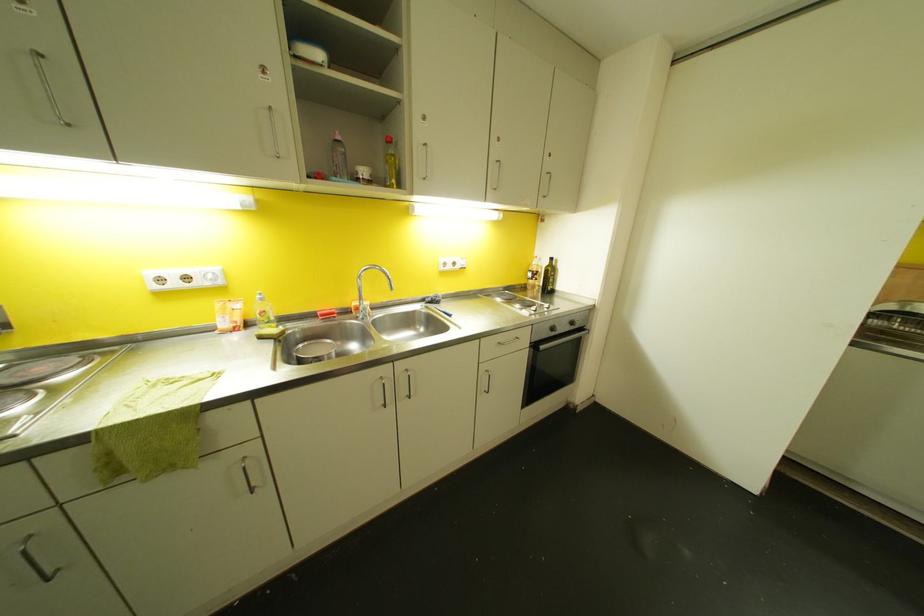
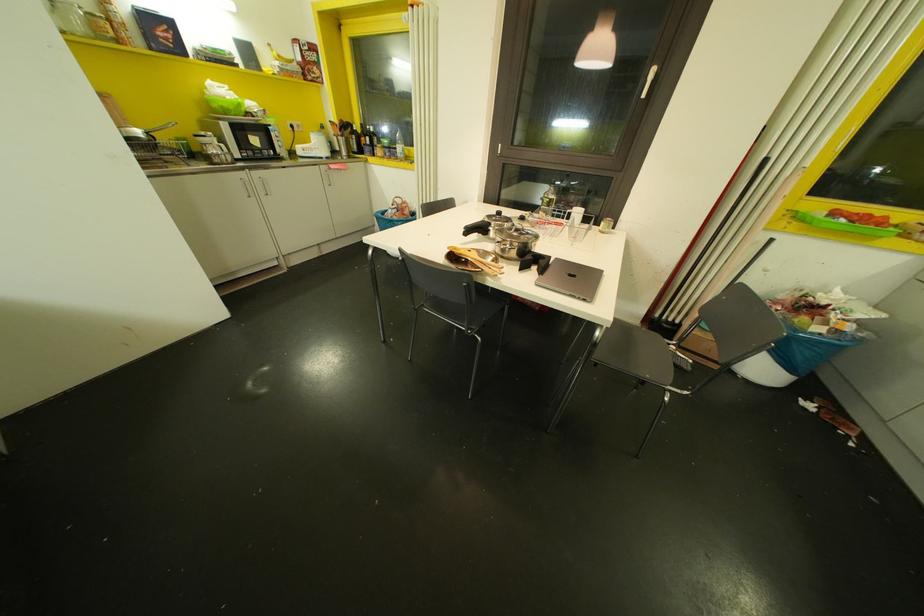
First-person continuous shooting, in which direction is the camera rotating?

The rotation direction of the camera is right-down.